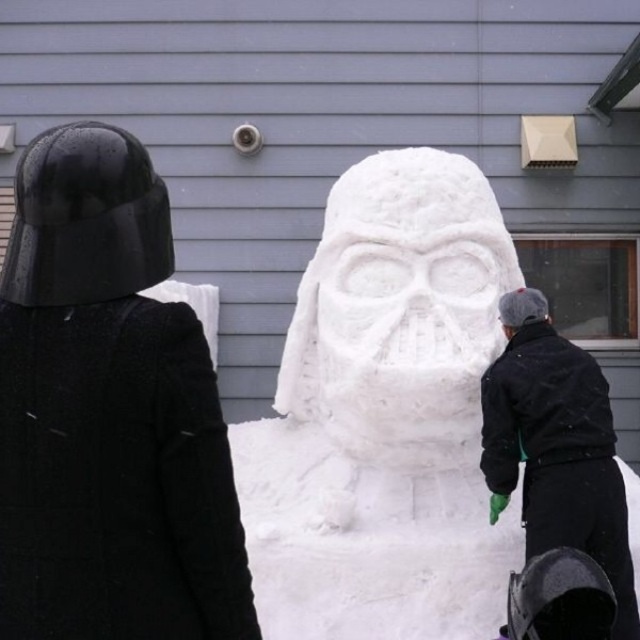
Question: Which point is closer to the camera?

Choices:
 (A) white fluffy snowman at center
 (B) black matte jacket at lower right

Answer: (B)

Question: Which object is closer to the camera taking this photo?

Choices:
 (A) black matte jacket at lower right
 (B) white fluffy snowman at center

Answer: (A)

Question: Where is white fluffy snowman at center located in relation to black matte jacket at lower right in the image?

Choices:
 (A) below
 (B) above

Answer: (B)

Question: Is white fluffy snowman at center above black matte jacket at lower right?

Choices:
 (A) no
 (B) yes

Answer: (B)

Question: Considering the relative positions of white fluffy snowman at center and black matte jacket at lower right in the image provided, where is white fluffy snowman at center located with respect to black matte jacket at lower right?

Choices:
 (A) below
 (B) above

Answer: (B)